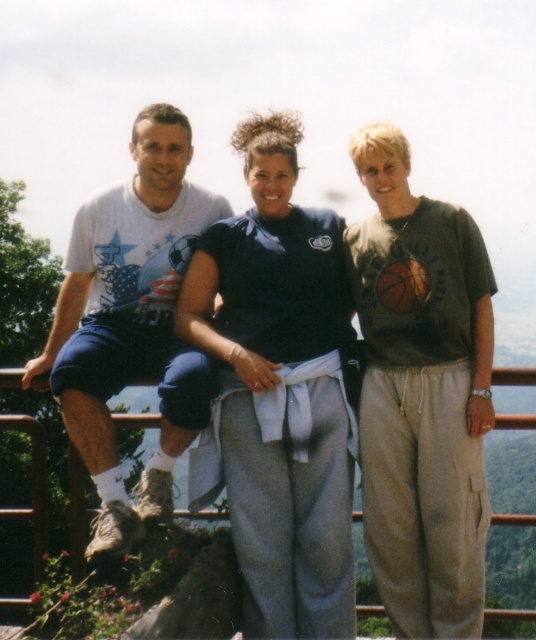
Is dark blue cotton shirt at center bigger than orange matte basketball at right?

Correct, dark blue cotton shirt at center is larger in size than orange matte basketball at right.

Based on the photo, between dark blue cotton shirt at center and orange matte basketball at right, which one has more height?

With more height is dark blue cotton shirt at center.

Between point (492, 310) and point (379, 276), which one is positioned in front?

Positioned in front is point (379, 276).

The height and width of the screenshot is (640, 536). Find the location of `dark blue cotton shirt at center`. dark blue cotton shirt at center is located at coordinates 422,400.

Which is in front, point (123, 340) or point (420, 275)?

Point (420, 275) is more forward.

Does point (139, 321) lie behind point (385, 296)?

Yes, point (139, 321) is behind point (385, 296).

This screenshot has height=640, width=536. What are the coordinates of `white cotton t-shirt at left` in the screenshot? It's located at (131, 323).

Which of these two, dark blue jersey at center or white cotton t-shirt at left, stands taller?

With more height is white cotton t-shirt at left.

Who is more forward, (327, 260) or (122, 547)?

Point (122, 547)

Identify the location of dark blue jersey at center. Image resolution: width=536 pixels, height=640 pixels. (279, 388).